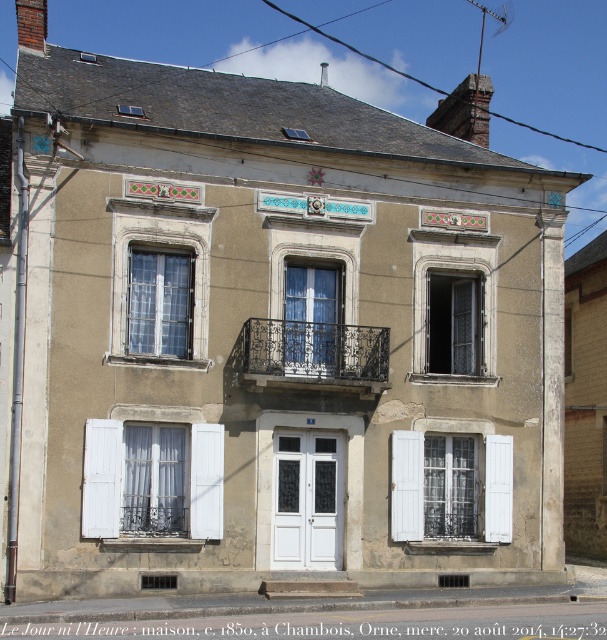
Question: Is white wood shutter at lower left behind white painted wood at center?

Choices:
 (A) yes
 (B) no

Answer: (B)

Question: Does white wooden shutter at lower center come in front of white painted wood at center?

Choices:
 (A) yes
 (B) no

Answer: (B)

Question: Which point is closer to the camera?

Choices:
 (A) white wooden shutter at lower center
 (B) wrought iron balcony at center

Answer: (B)

Question: Is white wood shutter at lower left below white painted wood at center?

Choices:
 (A) no
 (B) yes

Answer: (B)

Question: Which object appears farthest from the camera in this image?

Choices:
 (A) white painted wood at center
 (B) wrought iron balcony at center
 (C) white wooden shutter at lower center

Answer: (C)

Question: Estimate the real-world distances between objects in this image. Which object is closer to the white wood shutter at lower left?

Choices:
 (A) wrought iron balcony at center
 (B) white wood shutter at left
 (C) white painted wood at center
 (D) white wooden shutter at lower center

Answer: (B)